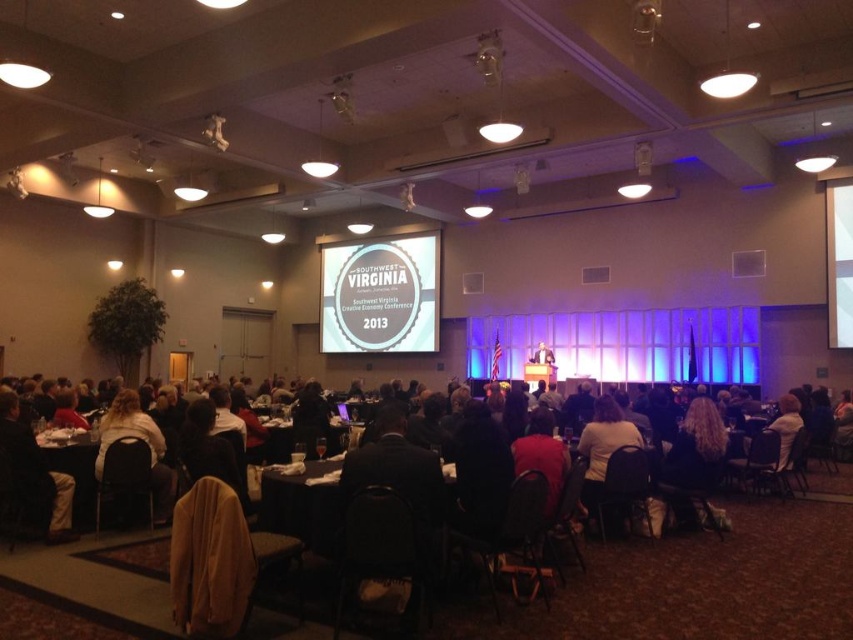
Question: Observing the image, what is the correct spatial positioning of matte white sign at center in reference to dark brown leather jacket at lower left?

Choices:
 (A) left
 (B) right

Answer: (B)

Question: Is dark brown leather jacket at center smaller than dark brown leather jacket at lower left?

Choices:
 (A) no
 (B) yes

Answer: (A)

Question: Is matte white sign at center closer to the viewer compared to dark brown leather jacket at lower left?

Choices:
 (A) yes
 (B) no

Answer: (B)

Question: Estimate the real-world distances between objects in this image. Which object is farther from the dark brown leather jacket at lower left?

Choices:
 (A) dark brown leather jacket at center
 (B) wooden table at lower left
 (C) matte white sign at center
 (D) black fabric table at center

Answer: (C)

Question: Which of the following is the closest to the observer?

Choices:
 (A) wooden table at lower left
 (B) matte white sign at center

Answer: (A)

Question: Which object appears closest to the camera in this image?

Choices:
 (A) wooden table at lower left
 (B) dark brown leather jacket at lower left
 (C) black fabric table at center

Answer: (C)